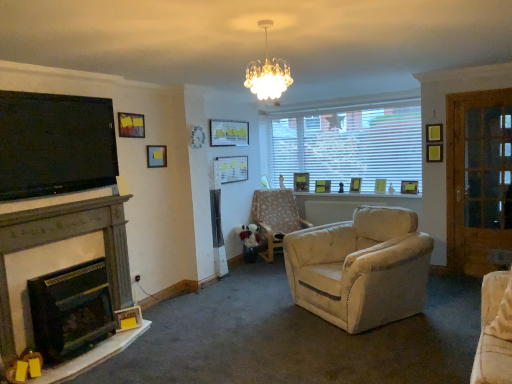
Question: Is matte yellow picture frame at upper right, arranged as the 7th picture frame when viewed from the left, beside matte glass picture frame at upper center, positioned as the 7th picture frame in back-to-front order?

Choices:
 (A) no
 (B) yes

Answer: (A)

Question: From the image's perspective, is matte yellow picture frame at upper right, which ranks as the 7th picture frame in front-to-back order, located above matte glass picture frame at upper center, positioned as the third picture frame in front-to-back order?

Choices:
 (A) yes
 (B) no

Answer: (B)

Question: Considering the relative sizes of matte yellow picture frame at upper right, which ranks as the 7th picture frame in front-to-back order, and matte glass picture frame at upper center, the seventh picture frame positioned from the right, in the image provided, is matte yellow picture frame at upper right, which ranks as the 7th picture frame in front-to-back order, bigger than matte glass picture frame at upper center, the seventh picture frame positioned from the right,?

Choices:
 (A) no
 (B) yes

Answer: (A)

Question: From the image's perspective, is matte yellow picture frame at upper right, arranged as the 7th picture frame when viewed from the left, beneath matte glass picture frame at upper center, acting as the third picture frame starting from the left?

Choices:
 (A) no
 (B) yes

Answer: (B)

Question: From a real-world perspective, does matte yellow picture frame at upper right, which ranks as the 7th picture frame in front-to-back order, stand above matte glass picture frame at upper center, positioned as the 7th picture frame in back-to-front order?

Choices:
 (A) yes
 (B) no

Answer: (B)

Question: From a real-world perspective, does matte yellow picture frame at upper right, which ranks as the 7th picture frame in front-to-back order, sit lower than matte glass picture frame at upper center, the seventh picture frame positioned from the right?

Choices:
 (A) no
 (B) yes

Answer: (B)

Question: Is crystalline glass chandelier at upper center behind matte white picture frame at center, the 4th picture frame positioned from the front?

Choices:
 (A) no
 (B) yes

Answer: (A)

Question: Can you confirm if crystalline glass chandelier at upper center is taller than matte white picture frame at center, which is counted as the fourth picture frame, starting from the left?

Choices:
 (A) yes
 (B) no

Answer: (B)

Question: Is the surface of crystalline glass chandelier at upper center in direct contact with matte white picture frame at center, which appears as the 6th picture frame when viewed from the right?

Choices:
 (A) yes
 (B) no

Answer: (B)

Question: Is crystalline glass chandelier at upper center looking in the opposite direction of matte white picture frame at center, placed as the 6th picture frame when sorted from back to front?

Choices:
 (A) yes
 (B) no

Answer: (B)

Question: Is crystalline glass chandelier at upper center completely or partially outside of matte white picture frame at center, placed as the 6th picture frame when sorted from back to front?

Choices:
 (A) yes
 (B) no

Answer: (A)

Question: Does crystalline glass chandelier at upper center have a larger size compared to matte white picture frame at center, which appears as the 6th picture frame when viewed from the right?

Choices:
 (A) no
 (B) yes

Answer: (B)

Question: Is floral fabric chair at center turned away from crystalline glass chandelier at upper center?

Choices:
 (A) yes
 (B) no

Answer: (B)